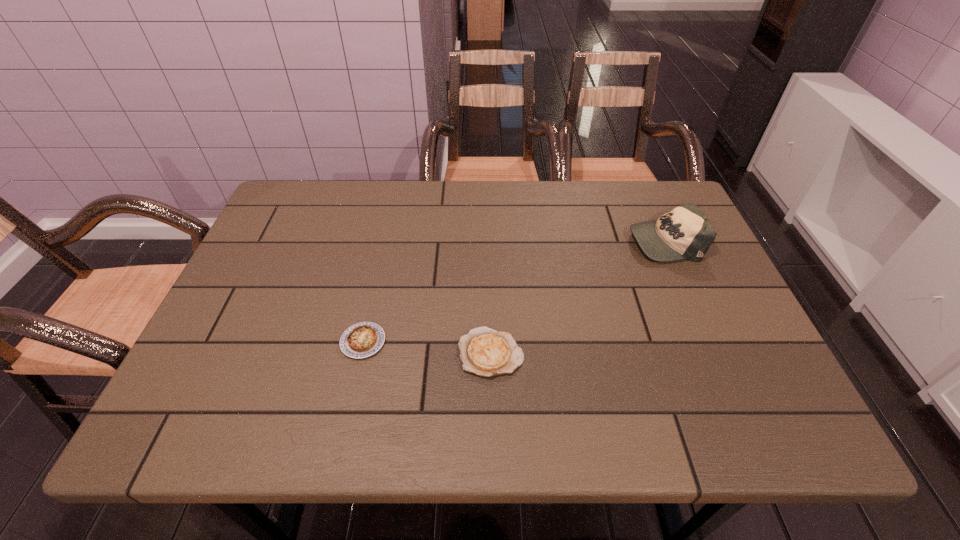
The height and width of the screenshot is (540, 960). I want to click on the rightmost object, so click(x=683, y=233).

Find the location of a particular element. This screenshot has width=960, height=540. baseball cap is located at coordinates (683, 233).

Identify the location of the leftmost object. pos(363,339).

Where is `the second object from left to right`? Image resolution: width=960 pixels, height=540 pixels. the second object from left to right is located at coordinates (486, 352).

Identify the location of vacant space situated 0.280m on the front-facing side of the baseball cap. This screenshot has height=540, width=960. (525, 241).

Find the location of a particular element. The image size is (960, 540). free space located 0.300m on the front-facing side of the baseball cap is located at coordinates (518, 241).

Where is `free location located 0.250m on the front-facing side of the baseball cap`? Image resolution: width=960 pixels, height=540 pixels. free location located 0.250m on the front-facing side of the baseball cap is located at coordinates (537, 241).

Identify the location of free space located 0.300m on the left of the leftmost object. (204, 342).

The image size is (960, 540). Find the location of `free space located on the right of the right quiche`. free space located on the right of the right quiche is located at coordinates (562, 353).

At what (x,y) coordinates should I click in order to perform the action: click on object that is at the far edge. Please return your answer as a coordinate pair (x, y). Looking at the image, I should click on (683, 233).